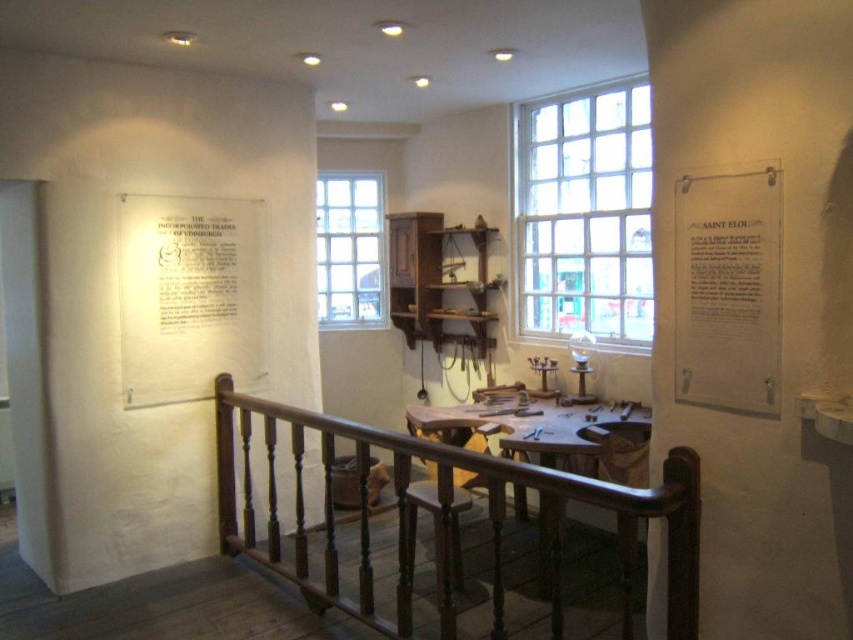
Question: Does dark wood railing at center have a smaller size compared to clear glass window at center?

Choices:
 (A) yes
 (B) no

Answer: (B)

Question: Which object is farther from the camera taking this photo?

Choices:
 (A) clear glass window at center
 (B) dark wood railing at center
 (C) dark wood table at center

Answer: (A)

Question: Is clear glass window at upper center to the right of white paper at upper left from the viewer's perspective?

Choices:
 (A) no
 (B) yes

Answer: (B)

Question: Which of the following is the farthest from the observer?

Choices:
 (A) white paper at upper left
 (B) clear glass window at upper center
 (C) dark wood table at center
 (D) dark wood railing at center

Answer: (B)

Question: Is dark wood railing at center wider than clear glass window at upper center?

Choices:
 (A) yes
 (B) no

Answer: (A)

Question: Estimate the real-world distances between objects in this image. Which object is farther from the dark wood table at center?

Choices:
 (A) clear glass window at upper center
 (B) white paper at upper left
 (C) clear glass window at center
 (D) dark wood railing at center

Answer: (C)